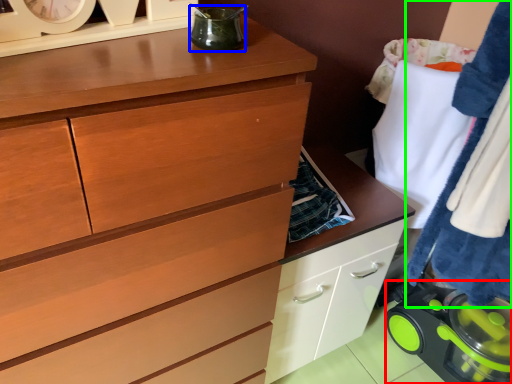
Question: Which object is positioned farthest from appliance (highlighted by a red box)? Select from appliance (highlighted by a blue box) and clothing (highlighted by a green box).

Choices:
 (A) appliance
 (B) clothing

Answer: (A)